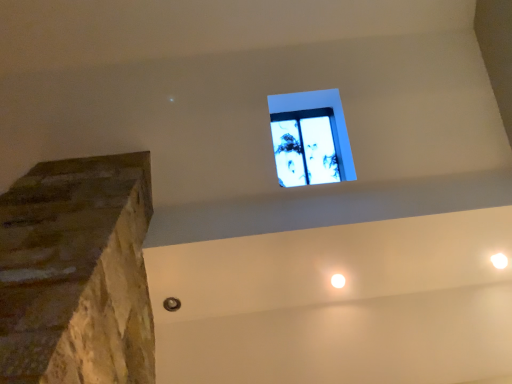
Question: Should I look upward or downward to see white glossy light at upper right?

Choices:
 (A) down
 (B) up

Answer: (A)